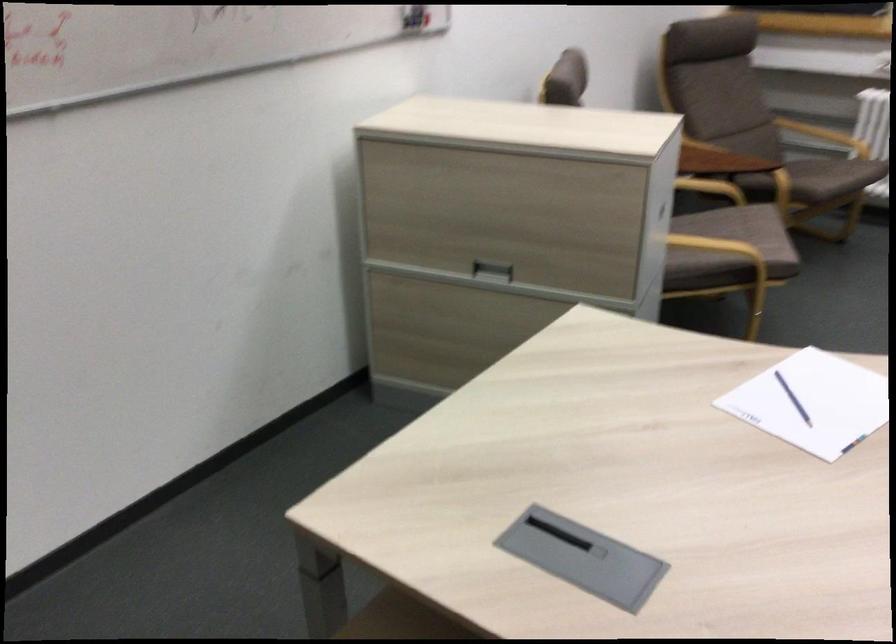
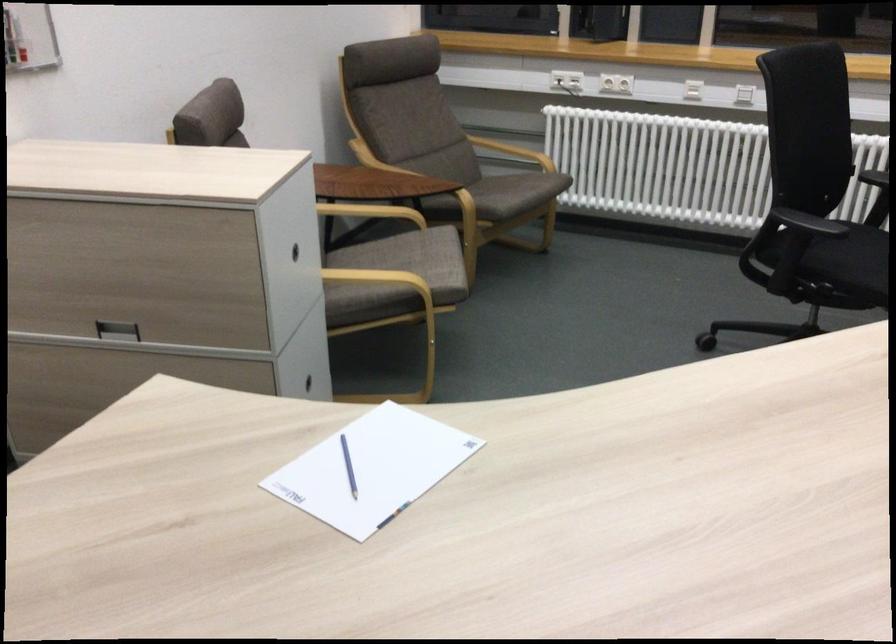
Where in the second image is the point corresponding to (693,181) from the first image?

(371, 212)